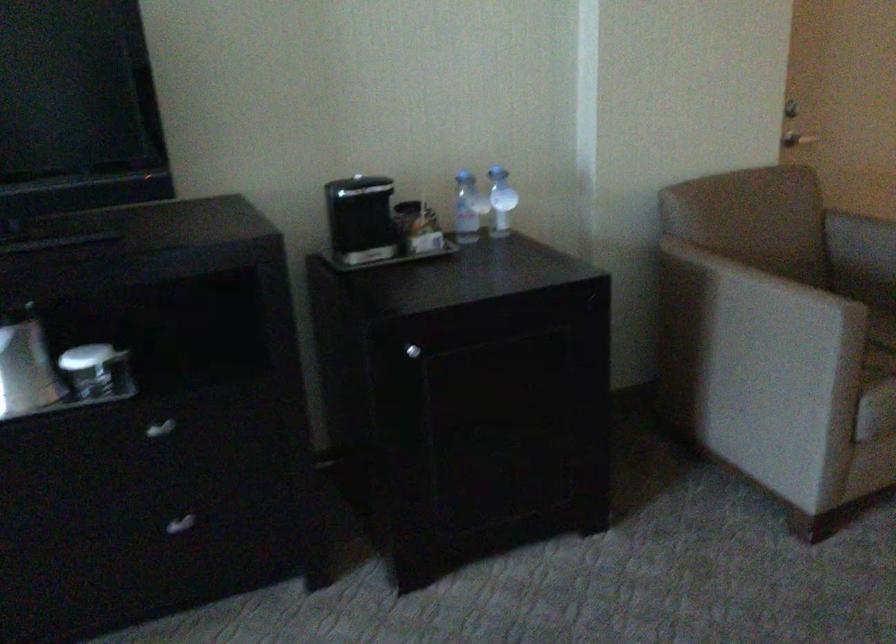
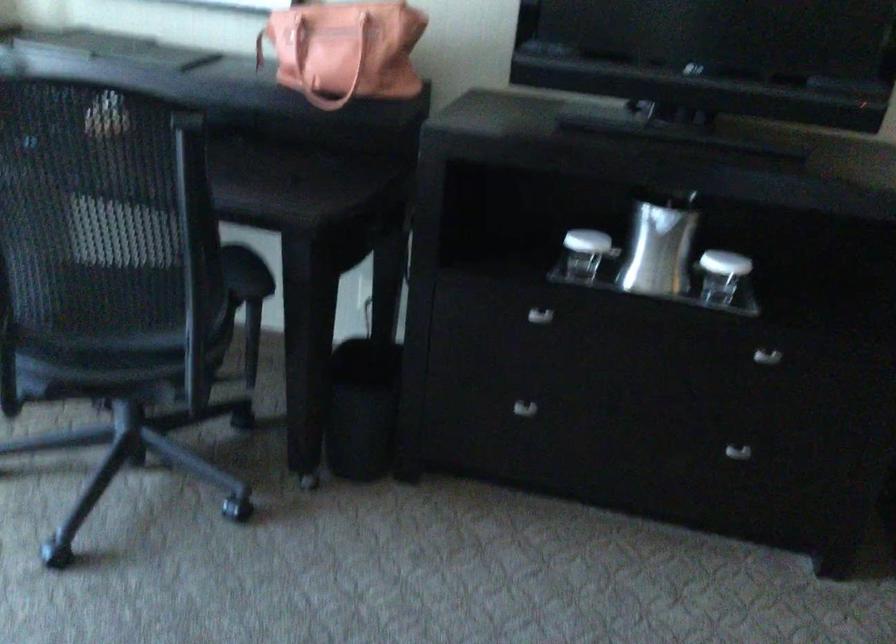
Question: I am providing you with two images of the same scene from different viewpoints. Please identify which objects are invisible in image2.

Choices:
 (A) silver ice bucket
 (B) orange handbag handle
 (C) glass with lid
 (D) none of these

Answer: (D)